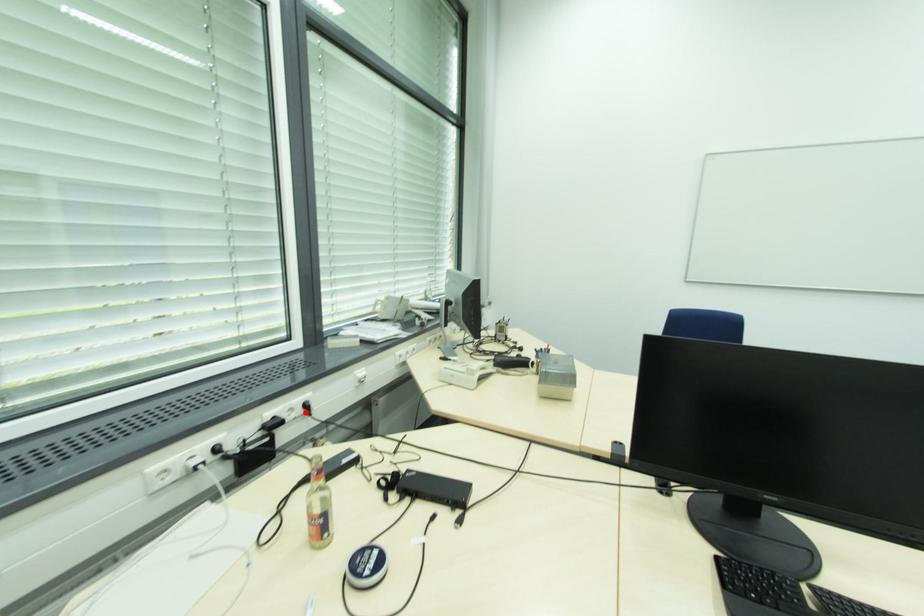
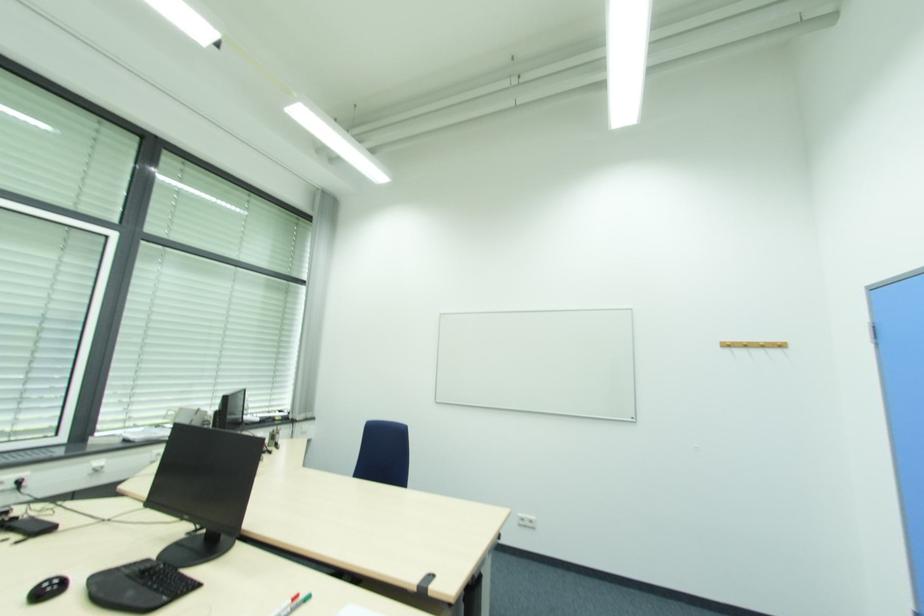
Locate, in the second image, the point that corresponds to the highlighted location in the first image.

(17, 487)